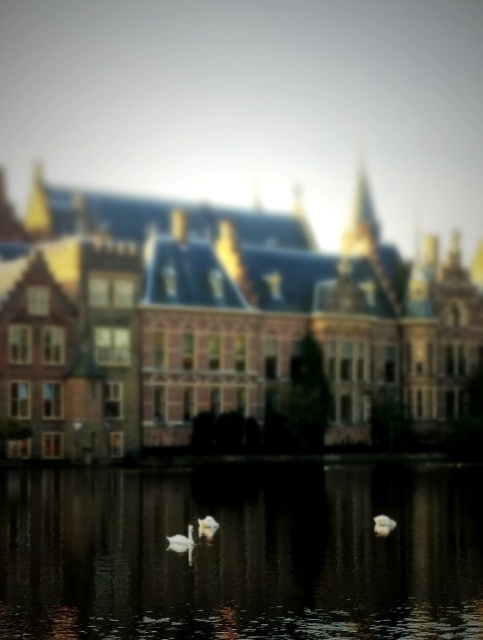
You are standing on a bridge overlooking the brown brick palace at center and the smooth reflective water at center. Which object is closer to you?

The brown brick palace at center is closer to you than the smooth reflective water at center because it is further to the viewer.